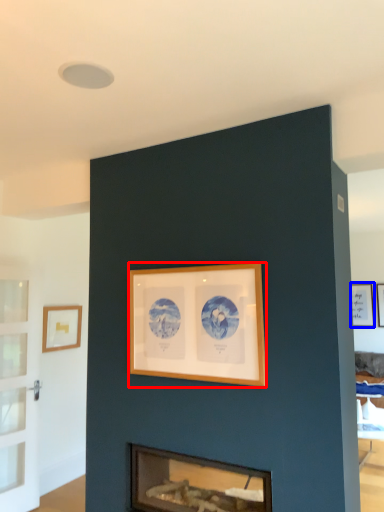
Question: Which of the following is the closest to the observer, picture frame (highlighted by a red box) or picture frame (highlighted by a blue box)?

Choices:
 (A) picture frame
 (B) picture frame

Answer: (A)